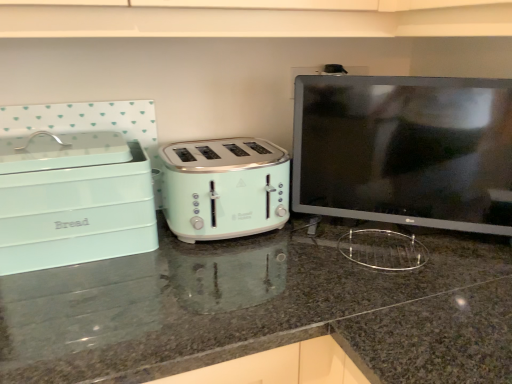
Question: From a real-world perspective, is mint green plastic bread bin at left positioned above or below matte green toaster at center?

Choices:
 (A) above
 (B) below

Answer: (A)

Question: Is mint green plastic bread bin at left inside or outside of matte green toaster at center?

Choices:
 (A) inside
 (B) outside

Answer: (A)

Question: Based on their relative distances, which object is nearer to the matte black monitor at right?

Choices:
 (A) matte green toaster at center
 (B) mint green plastic bread bin at left
 (C) mint green plastic toaster at center

Answer: (C)

Question: Estimate the real-world distances between objects in this image. Which object is farther from the mint green plastic toaster at center?

Choices:
 (A) matte black monitor at right
 (B) matte green toaster at center
 (C) mint green plastic bread bin at left

Answer: (A)